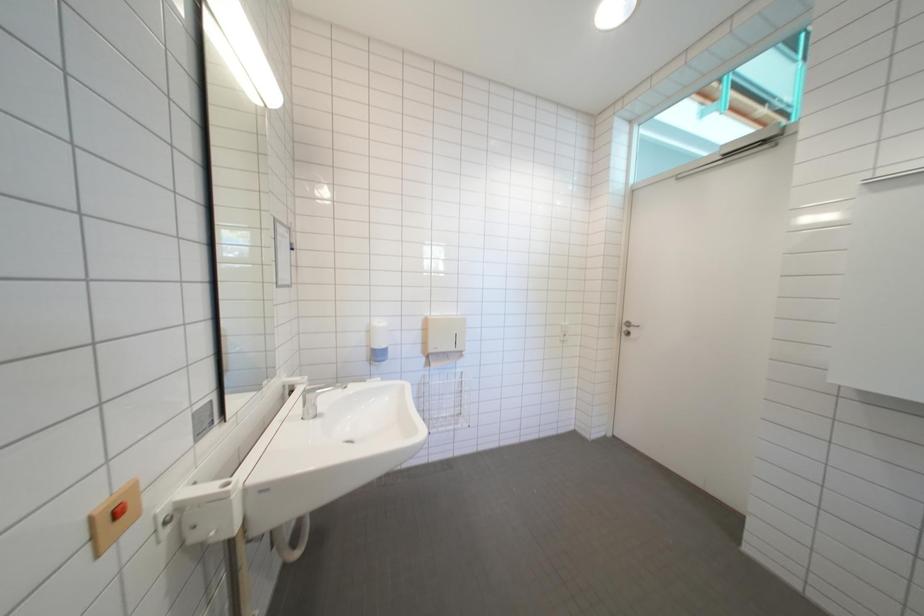
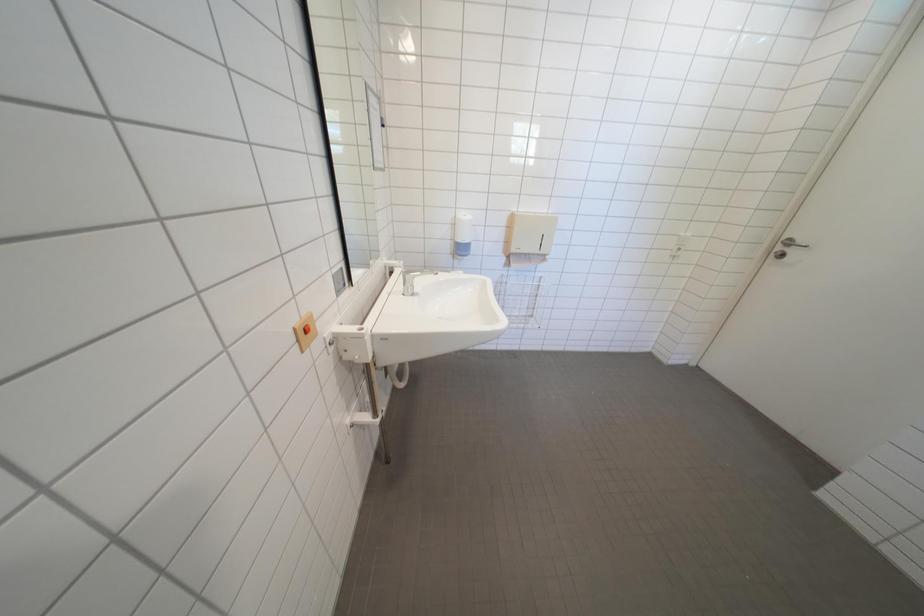
Question: Which direction would the cameraman need to move to produce the second image? Reply with the corresponding letter.

Choices:
 (A) Left
 (B) Right
 (C) Forward
 (D) Backward

Answer: (A)